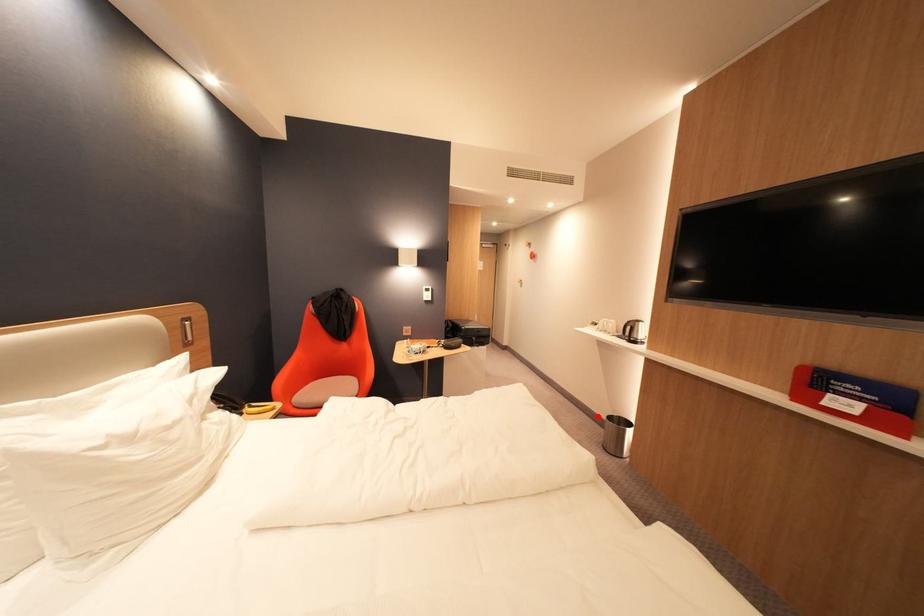
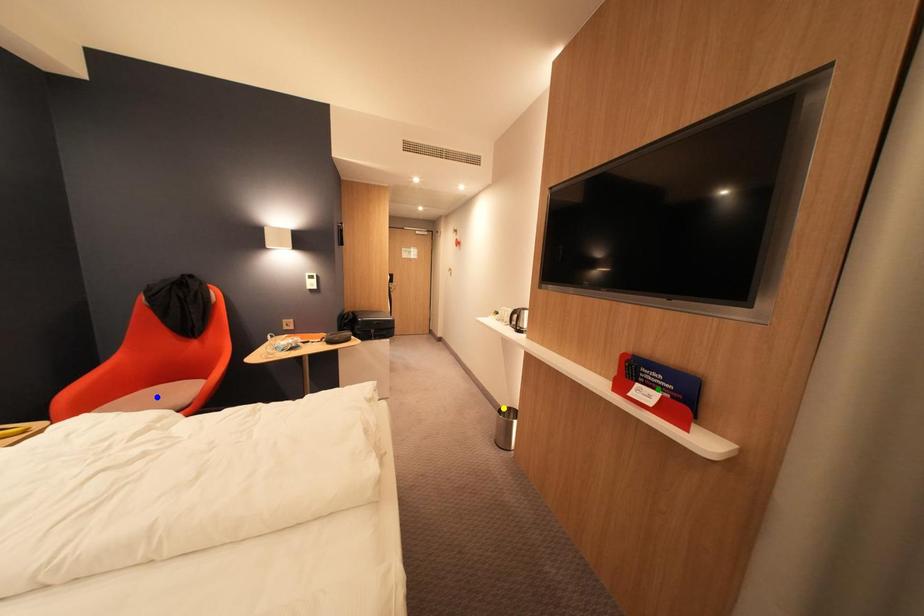
Question: I am providing you with two images of the same scene from different viewpoints. A red point is marked on the first image. You are given multiple points on the second image. In image 2, which mark is for the same physical point as the one in image 1?

Choices:
 (A) blue point
 (B) yellow point
 (C) green point

Answer: (B)